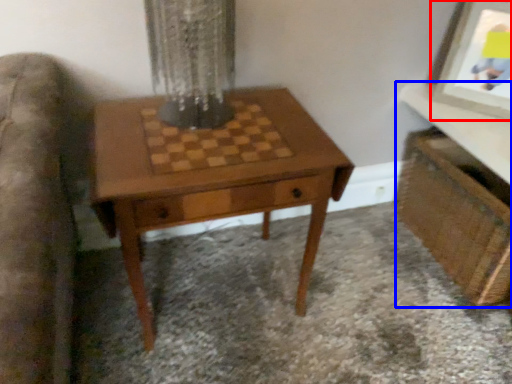
Question: Which object appears farthest to the camera in this image, picture frame (highlighted by a red box) or vanity (highlighted by a blue box)?

Choices:
 (A) picture frame
 (B) vanity

Answer: (A)